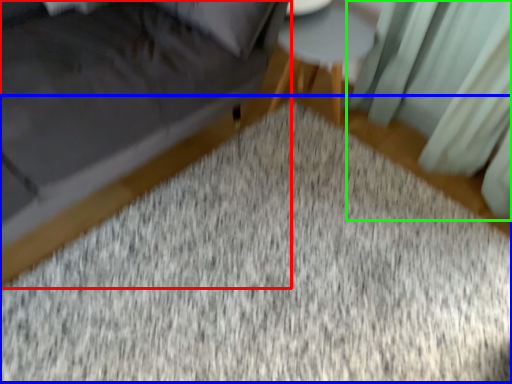
Question: Which is farther away from furniture (highlighted by a red box)? mat (highlighted by a blue box) or curtain (highlighted by a green box)?

Choices:
 (A) mat
 (B) curtain

Answer: (B)